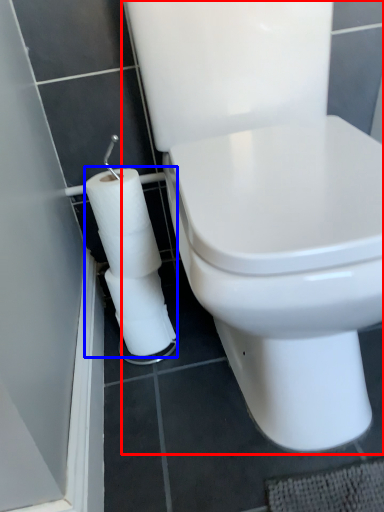
Question: Which object is further to the camera taking this photo, toilet (highlighted by a red box) or toilet paper (highlighted by a blue box)?

Choices:
 (A) toilet
 (B) toilet paper

Answer: (B)